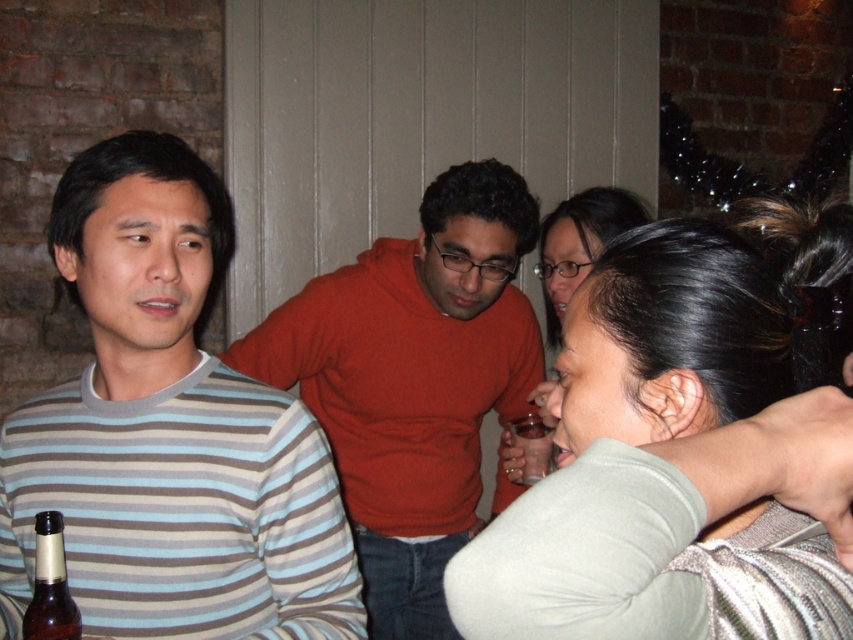
Can you confirm if matte orange sweater at center is taller than brown glass bottle at lower left?

Indeed, matte orange sweater at center has a greater height compared to brown glass bottle at lower left.

Is matte orange sweater at center thinner than brown glass bottle at lower left?

No.

Is point (355, 404) behind point (28, 618)?

That is True.

The width and height of the screenshot is (853, 640). Identify the location of matte orange sweater at center. (413, 380).

Does brown glass bottle at lower left have a smaller size compared to translucent plastic cup at lower center?

Yes, brown glass bottle at lower left is smaller than translucent plastic cup at lower center.

Is point (74, 611) more distant than point (521, 474)?

That is False.

Measure the distance between point (73, 612) and camera.

Point (73, 612) and camera are 36.43 inches apart.

Image resolution: width=853 pixels, height=640 pixels. I want to click on brown glass bottle at lower left, so click(50, 586).

Is dark gray sweater at lower right to the right of translucent plastic cup at lower center from the viewer's perspective?

Yes, dark gray sweater at lower right is to the right of translucent plastic cup at lower center.

Can you confirm if dark gray sweater at lower right is taller than translucent plastic cup at lower center?

Indeed, dark gray sweater at lower right has a greater height compared to translucent plastic cup at lower center.

Identify the location of dark gray sweater at lower right. The image size is (853, 640). pyautogui.click(x=672, y=465).